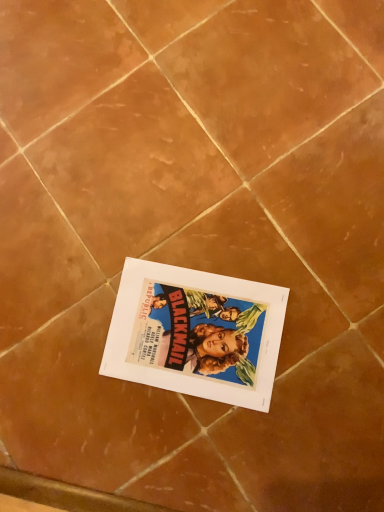
Identify the location of free space behind matte paper poster at center. [115, 230].